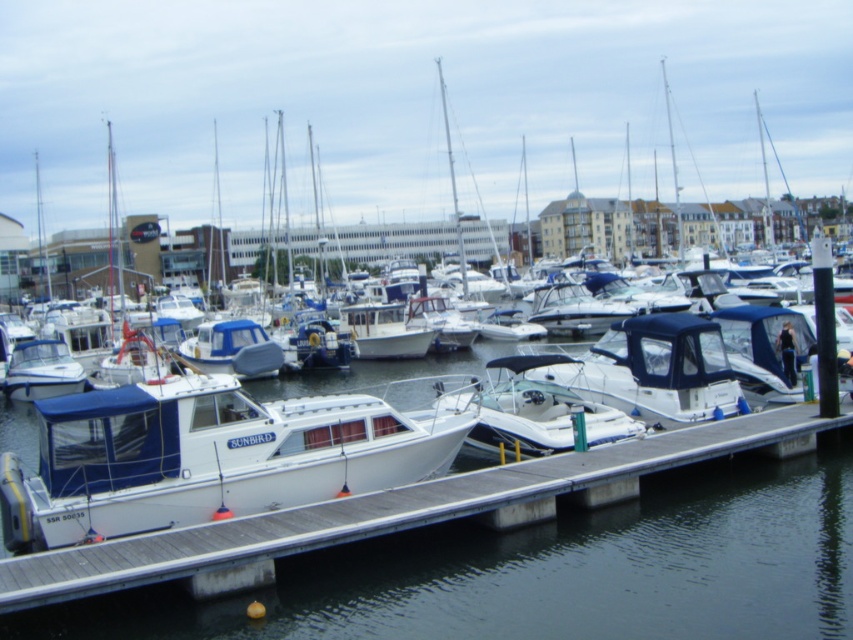
Question: Does white wood dock at center appear under white matte boat at center?

Choices:
 (A) yes
 (B) no

Answer: (A)

Question: Does white wood dock at center have a larger size compared to white matte boat at center?

Choices:
 (A) yes
 (B) no

Answer: (A)

Question: Is white wood dock at center above white matte boat at center?

Choices:
 (A) yes
 (B) no

Answer: (B)